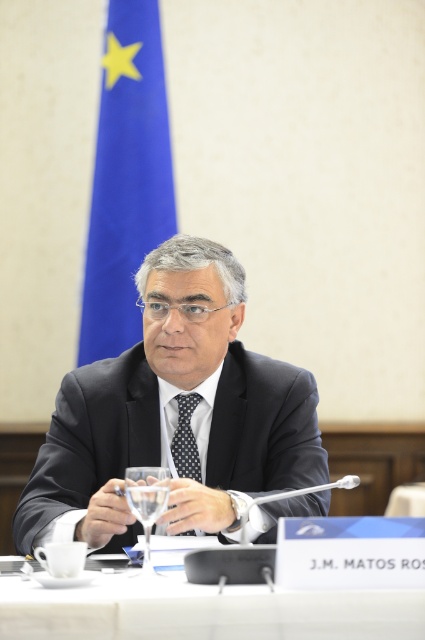
Question: Which point is closer to the camera taking this photo?

Choices:
 (A) (263, 445)
 (B) (170, 177)
 (C) (192, 396)

Answer: (A)

Question: Is dark gray suit at center below blue fabric flag at upper left?

Choices:
 (A) no
 (B) yes

Answer: (B)

Question: Is dark gray suit at center smaller than polka dot silk tie at center?

Choices:
 (A) no
 (B) yes

Answer: (A)

Question: Estimate the real-world distances between objects in this image. Which object is closer to the polka dot silk tie at center?

Choices:
 (A) clear glass wine glass at center
 (B) blue fabric flag at upper left
 (C) white glossy table at center

Answer: (A)

Question: Which point is closer to the camera?

Choices:
 (A) blue fabric flag at upper left
 (B) clear glass wine glass at center
 (C) polka dot silk tie at center
 (D) white glossy table at center

Answer: (D)

Question: Can you confirm if blue fabric flag at upper left is positioned to the left of polka dot silk tie at center?

Choices:
 (A) yes
 (B) no

Answer: (A)